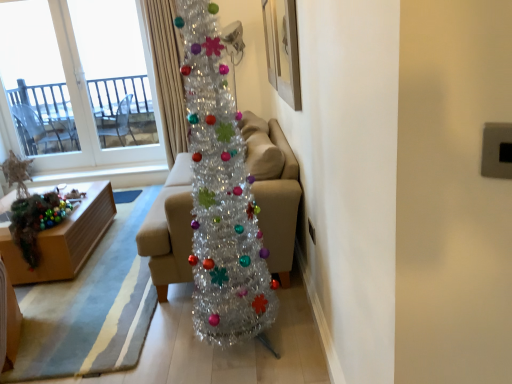
Question: From a real-world perspective, relative to wooden picture frame at upper center, is transparent glass window at upper left vertically above or below?

Choices:
 (A) below
 (B) above

Answer: (A)

Question: Is transparent glass window at upper left to the left or to the right of wooden picture frame at upper center in the image?

Choices:
 (A) left
 (B) right

Answer: (A)

Question: Which is nearer to the wooden picture frame at upper center?

Choices:
 (A) silky beige curtain at upper center
 (B) shiny metallic christmas tree at center
 (C) wooden box at lower left
 (D) beige fabric couch at center
 (E) transparent glass window at upper left

Answer: (D)

Question: Which object is positioned closest to the wooden box at lower left?

Choices:
 (A) transparent glass window at upper left
 (B) beige fabric couch at center
 (C) silky beige curtain at upper center
 (D) shiny metallic christmas tree at center
 (E) wooden picture frame at upper center

Answer: (C)